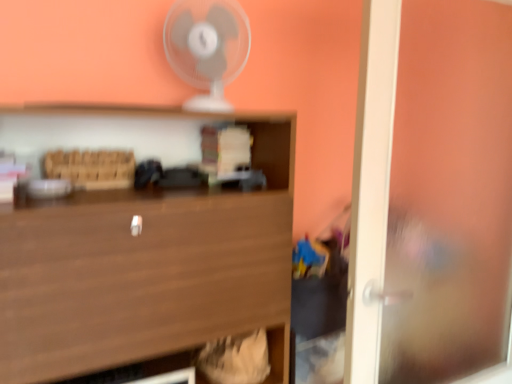
Question: From the image's perspective, does white plastic fan at upper center appear lower than wooden at center?

Choices:
 (A) yes
 (B) no

Answer: (B)

Question: Would you say white plastic fan at upper center is outside wooden at center?

Choices:
 (A) no
 (B) yes

Answer: (B)

Question: Is white plastic fan at upper center positioned in front of wooden at center?

Choices:
 (A) yes
 (B) no

Answer: (B)

Question: Is wooden at center at the back of white plastic fan at upper center?

Choices:
 (A) yes
 (B) no

Answer: (B)

Question: From a real-world perspective, is white plastic fan at upper center positioned under wooden at center based on gravity?

Choices:
 (A) yes
 (B) no

Answer: (B)

Question: Is white plastic fan at upper center with wooden at center?

Choices:
 (A) yes
 (B) no

Answer: (B)

Question: Can you confirm if transparent glass door at right is taller than wooden at center?

Choices:
 (A) no
 (B) yes

Answer: (B)

Question: Can you confirm if transparent glass door at right is thinner than wooden at center?

Choices:
 (A) no
 (B) yes

Answer: (B)

Question: Is transparent glass door at right closer to camera compared to wooden at center?

Choices:
 (A) yes
 (B) no

Answer: (B)

Question: Would you say transparent glass door at right is a long distance from wooden at center?

Choices:
 (A) no
 (B) yes

Answer: (A)

Question: Does transparent glass door at right have a lesser height compared to wooden at center?

Choices:
 (A) yes
 (B) no

Answer: (B)

Question: Can wooden at center be found inside transparent glass door at right?

Choices:
 (A) yes
 (B) no

Answer: (B)

Question: Considering the relative positions of white plastic fan at upper center and transparent glass door at right in the image provided, is white plastic fan at upper center behind transparent glass door at right?

Choices:
 (A) yes
 (B) no

Answer: (A)